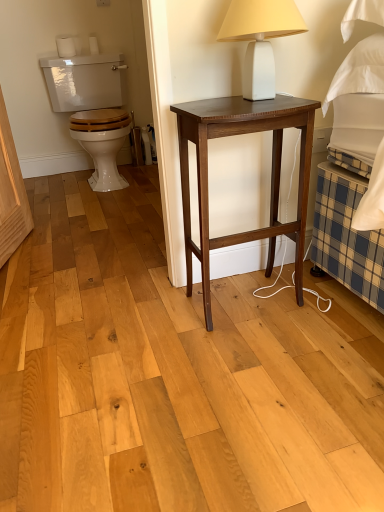
Question: Which is correct: dark wood nightstand at center is inside white matte toilet paper at upper left, which ranks as the 1th toilet paper in right-to-left order, or outside of it?

Choices:
 (A) outside
 (B) inside

Answer: (A)

Question: In the image, is dark wood nightstand at center on the left side or the right side of white matte toilet paper at upper left, which ranks as the 1th toilet paper in right-to-left order?

Choices:
 (A) left
 (B) right

Answer: (B)

Question: Based on their relative distances, which object is nearer to the white glossy toilet at left?

Choices:
 (A) dark wood nightstand at center
 (B) white matte table lamp at upper center
 (C) white matte toilet paper at upper left, which ranks as the 1th toilet paper in right-to-left order
 (D) white matte toilet paper at upper left, positioned as the first toilet paper in left-to-right order

Answer: (D)

Question: Based on their relative distances, which object is farther from the white matte table lamp at upper center?

Choices:
 (A) dark wood nightstand at center
 (B) white matte toilet paper at upper left, the second toilet paper from the left
 (C) white matte toilet paper at upper left, positioned as the first toilet paper in left-to-right order
 (D) white glossy toilet at left

Answer: (B)